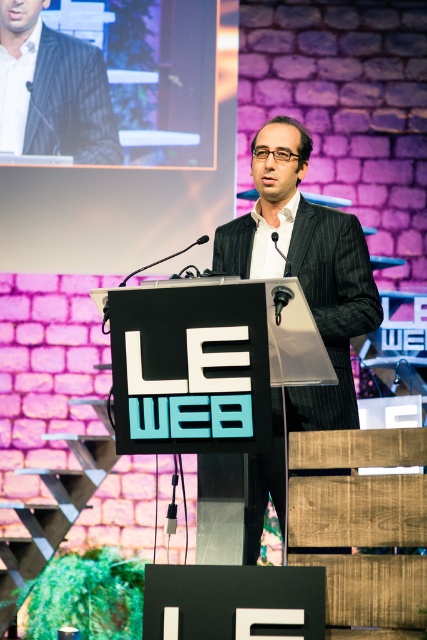
Question: Which point is farther to the camera?

Choices:
 (A) dark gray pinstripe suit at center
 (B) matte black suit at upper left

Answer: (B)

Question: Which object appears closest to the camera in this image?

Choices:
 (A) dark gray pinstripe suit at center
 (B) matte black suit at upper left

Answer: (A)

Question: Which point is farther from the camera taking this photo?

Choices:
 (A) (348, 301)
 (B) (99, 77)

Answer: (B)

Question: Can you confirm if dark gray pinstripe suit at center is positioned above matte black suit at upper left?

Choices:
 (A) no
 (B) yes

Answer: (A)

Question: Does dark gray pinstripe suit at center have a larger size compared to matte black suit at upper left?

Choices:
 (A) no
 (B) yes

Answer: (B)

Question: In this image, where is dark gray pinstripe suit at center located relative to matte black suit at upper left?

Choices:
 (A) below
 (B) above

Answer: (A)